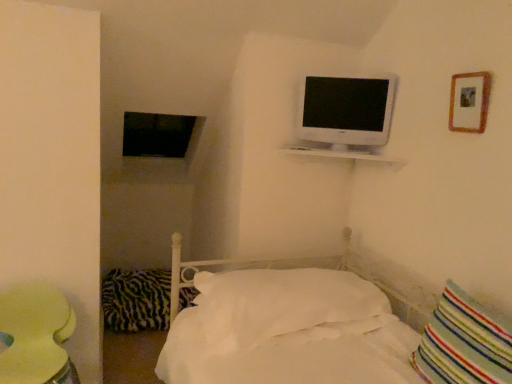
Question: From a real-world perspective, is white glossy television at upper right located higher than white soft pillow at center, which is the second pillow from front to back?

Choices:
 (A) no
 (B) yes

Answer: (B)

Question: Is white glossy television at upper right to the right of white soft pillow at center, which ranks as the second pillow in left-to-right order, from the viewer's perspective?

Choices:
 (A) yes
 (B) no

Answer: (A)

Question: Is white glossy television at upper right not near white soft pillow at center, which ranks as the second pillow in left-to-right order?

Choices:
 (A) yes
 (B) no

Answer: (B)

Question: From the image's perspective, is white glossy television at upper right located above white soft pillow at center, which is the second pillow from front to back?

Choices:
 (A) yes
 (B) no

Answer: (A)

Question: Does white glossy television at upper right have a smaller size compared to white soft pillow at center, which ranks as the second pillow in left-to-right order?

Choices:
 (A) yes
 (B) no

Answer: (A)

Question: Can you confirm if white glossy television at upper right is thinner than white soft pillow at center, which is the second pillow from front to back?

Choices:
 (A) yes
 (B) no

Answer: (A)

Question: Is white glossy television at upper right next to wooden picture frame at upper right and touching it?

Choices:
 (A) yes
 (B) no

Answer: (B)

Question: Is white glossy television at upper right taller than wooden picture frame at upper right?

Choices:
 (A) yes
 (B) no

Answer: (A)

Question: Considering the relative positions of white glossy television at upper right and wooden picture frame at upper right in the image provided, is white glossy television at upper right to the right of wooden picture frame at upper right from the viewer's perspective?

Choices:
 (A) yes
 (B) no

Answer: (B)

Question: Considering the relative positions of white glossy television at upper right and wooden picture frame at upper right in the image provided, is white glossy television at upper right in front of wooden picture frame at upper right?

Choices:
 (A) yes
 (B) no

Answer: (B)

Question: From a real-world perspective, is white glossy television at upper right physically below wooden picture frame at upper right?

Choices:
 (A) yes
 (B) no

Answer: (A)

Question: Could you tell me if white glossy television at upper right is facing wooden picture frame at upper right?

Choices:
 (A) no
 (B) yes

Answer: (A)

Question: Does zebra-patterned fabric pillow at lower left, marked as the first pillow in a left-to-right arrangement, have a lesser width compared to wooden picture frame at upper right?

Choices:
 (A) yes
 (B) no

Answer: (B)